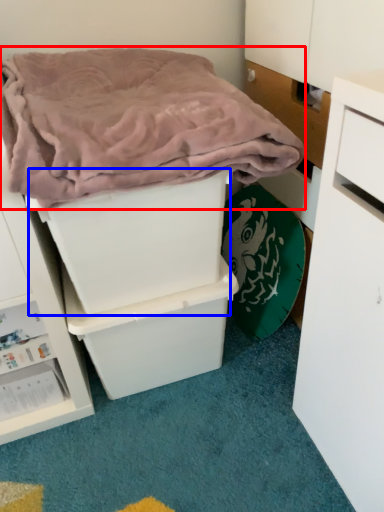
Question: Which object appears closest to the camera in this image, blanket (highlighted by a red box) or storage box (highlighted by a blue box)?

Choices:
 (A) blanket
 (B) storage box

Answer: (A)